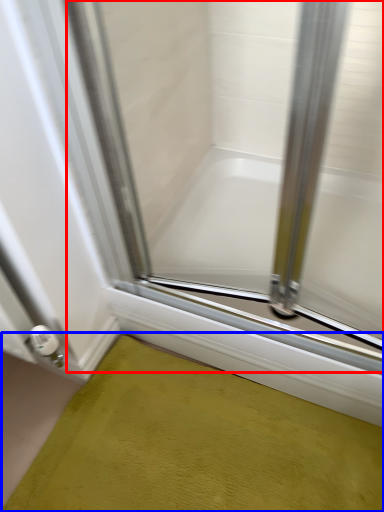
Question: Which object appears farthest to the camera in this image, glass door (highlighted by a red box) or bath mat (highlighted by a blue box)?

Choices:
 (A) glass door
 (B) bath mat

Answer: (B)